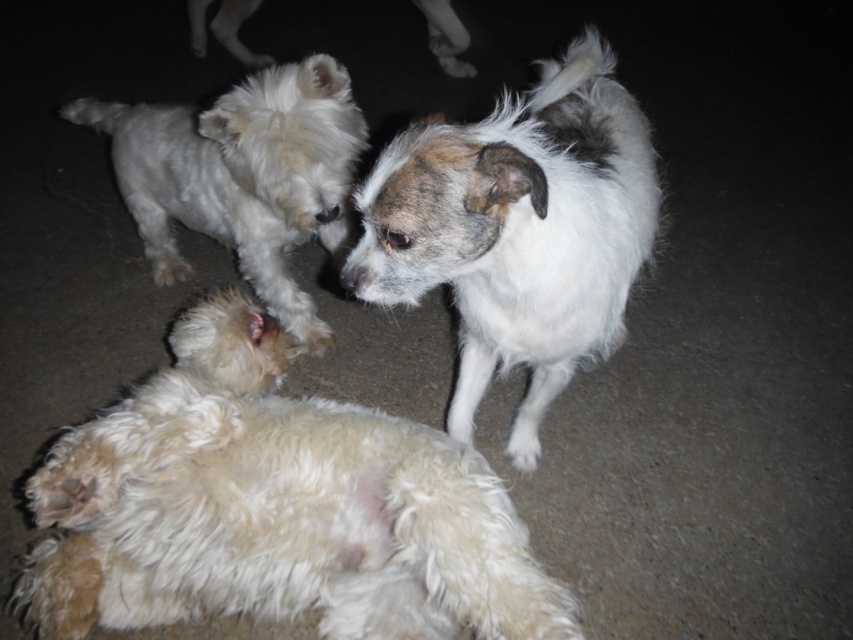
In the scene shown: Can you confirm if fluffy white dog at lower left is taller than white fluffy dog at upper left?

Incorrect, fluffy white dog at lower left's height is not larger of white fluffy dog at upper left's.

Does fluffy white dog at lower left appear under white fluffy dog at upper left?

Yes, fluffy white dog at lower left is below white fluffy dog at upper left.

Who is more distant from viewer, (196,460) or (227,116)?

Positioned behind is point (227,116).

You are a GUI agent. You are given a task and a screenshot of the screen. Output one action in this format:
    pyautogui.click(x=<x>, y=<y>)
    Task: Click on the fluffy white dog at lower left
    Image resolution: width=853 pixels, height=640 pixels.
    Given the screenshot: What is the action you would take?
    pyautogui.click(x=274, y=508)

Is fluffy white dog at lower left above white fluffy dog at center?

No.

Is fluffy white dog at lower left wider than white fluffy dog at center?

Yes, fluffy white dog at lower left is wider than white fluffy dog at center.

The image size is (853, 640). What do you see at coordinates (274, 508) in the screenshot? I see `fluffy white dog at lower left` at bounding box center [274, 508].

Find the location of a particular element. This screenshot has width=853, height=640. fluffy white dog at lower left is located at coordinates (274, 508).

Identify the location of white fluffy dog at center. The image size is (853, 640). (517, 228).

Can you confirm if white fluffy dog at center is bigger than white fluffy dog at upper left?

Correct, white fluffy dog at center is larger in size than white fluffy dog at upper left.

Who is more distant from viewer, [413,180] or [258,212]?

The point [258,212] is more distant.

Where is `white fluffy dog at center`? The width and height of the screenshot is (853, 640). white fluffy dog at center is located at coordinates (517, 228).